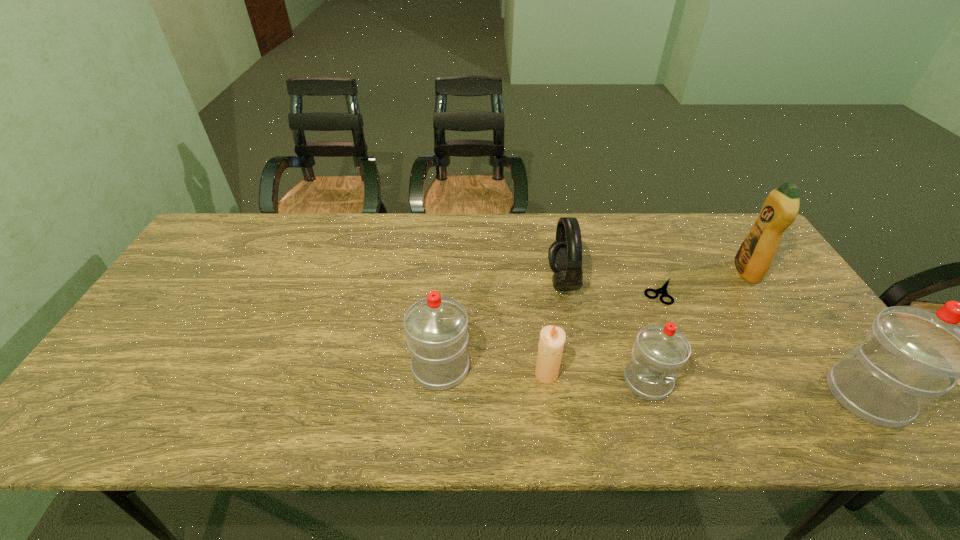
At what (x,y) coordinates should I click in order to perform the action: click on free space between the detergent and the shears. Please return your answer as a coordinate pair (x, y). Looking at the image, I should click on click(x=703, y=282).

Select which object appears as the sixth closest to the fourth object from left to right. Please provide its 2D coordinates. Your answer should be formatted as a tuple, i.e. [(x, y)], where the tuple contains the x and y coordinates of a point satisfying the conditions above.

[(753, 259)]

This screenshot has height=540, width=960. Find the location of `object identified as the third closest to the second object from left to right`. object identified as the third closest to the second object from left to right is located at coordinates (565, 254).

Locate which water bottle ranks in proximity to the sixth object from right to left. Please provide its 2D coordinates. Your answer should be formatted as a tuple, i.e. [(x, y)], where the tuple contains the x and y coordinates of a point satisfying the conditions above.

[(660, 351)]

Identify which water bottle is located as the nearest to the tallest water bottle. Please provide its 2D coordinates. Your answer should be formatted as a tuple, i.e. [(x, y)], where the tuple contains the x and y coordinates of a point satisfying the conditions above.

[(660, 351)]

This screenshot has height=540, width=960. Identify the location of blank space that satisfies the following two spatial constraints: 1. on the label of the detergent; 2. on the front side of the sixth object from right to left. (813, 374).

Find the location of a particular element. Image resolution: width=960 pixels, height=540 pixels. vacant region that satisfies the following two spatial constraints: 1. on the label of the detergent; 2. on the handle side of the tallest water bottle is located at coordinates (828, 396).

The width and height of the screenshot is (960, 540). Identify the location of free space in the image that satisfies the following two spatial constraints: 1. on the earcups of the third object from right to left; 2. on the left side of the third object from left to right. (564, 292).

Locate an element on the screen. The image size is (960, 540). vacant position in the image that satisfies the following two spatial constraints: 1. on the handle side of the tallest water bottle; 2. on the earcups of the headset is located at coordinates tap(782, 281).

The width and height of the screenshot is (960, 540). Find the location of `vacant space that satisfies the following two spatial constraints: 1. on the label of the detergent; 2. on the front side of the sixth object from right to left`. vacant space that satisfies the following two spatial constraints: 1. on the label of the detergent; 2. on the front side of the sixth object from right to left is located at coordinates (813, 374).